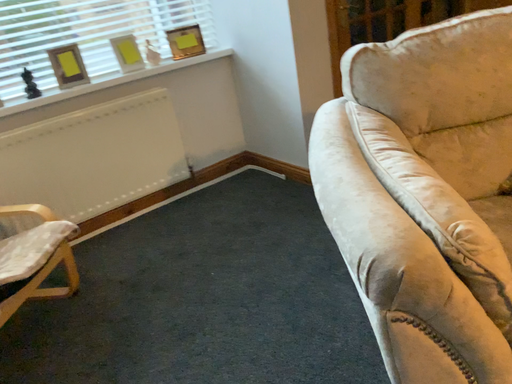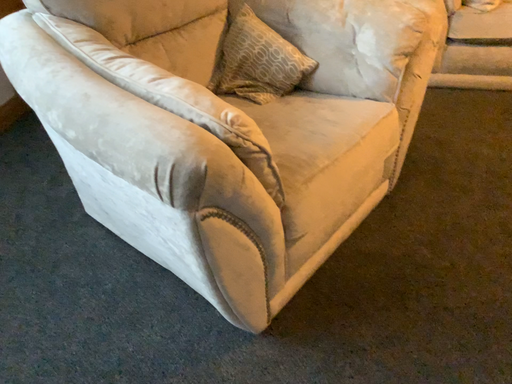
Question: Which way did the camera rotate in the video?

Choices:
 (A) rotated right
 (B) rotated left

Answer: (A)